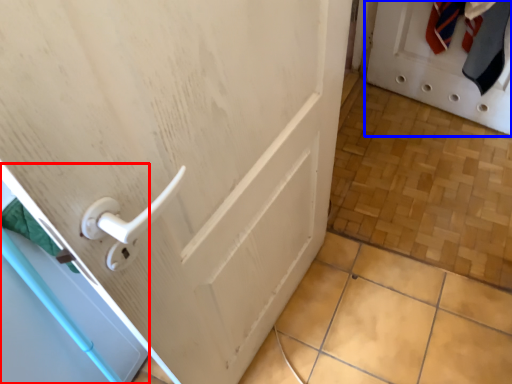
Question: Which of the following is the farthest to the observer, screen door (highlighted by a red box) or door (highlighted by a blue box)?

Choices:
 (A) screen door
 (B) door

Answer: (B)